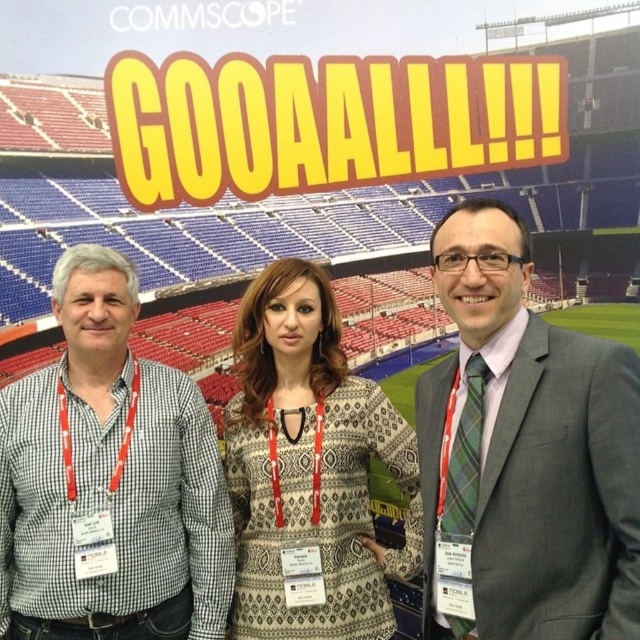
Which is more to the right, gray suit at center or checkered fabric shirt at left?

Positioned to the right is gray suit at center.

Who is positioned more to the left, gray suit at center or checkered fabric shirt at left?

Positioned to the left is checkered fabric shirt at left.

Image resolution: width=640 pixels, height=640 pixels. In order to click on gray suit at center in this screenshot , I will do `click(524, 451)`.

Find the location of a particular element. The image size is (640, 640). gray suit at center is located at coordinates (524, 451).

Can you confirm if checkered fabric shirt at left is thinner than patterned fabric dress at center?

Incorrect, checkered fabric shirt at left's width is not less than patterned fabric dress at center's.

Between checkered fabric shirt at left and patterned fabric dress at center, which one appears on the left side from the viewer's perspective?

Positioned to the left is checkered fabric shirt at left.

Who is more distant from viewer, (x=220, y=516) or (x=301, y=515)?

The point (x=220, y=516) is more distant.

Where is `checkered fabric shirt at left`? checkered fabric shirt at left is located at coordinates (109, 481).

What do you see at coordinates (524, 451) in the screenshot? This screenshot has width=640, height=640. I see `gray suit at center` at bounding box center [524, 451].

Does gray suit at center appear under patterned fabric dress at center?

No, gray suit at center is not below patterned fabric dress at center.

Locate an element on the screen. The image size is (640, 640). gray suit at center is located at coordinates (524, 451).